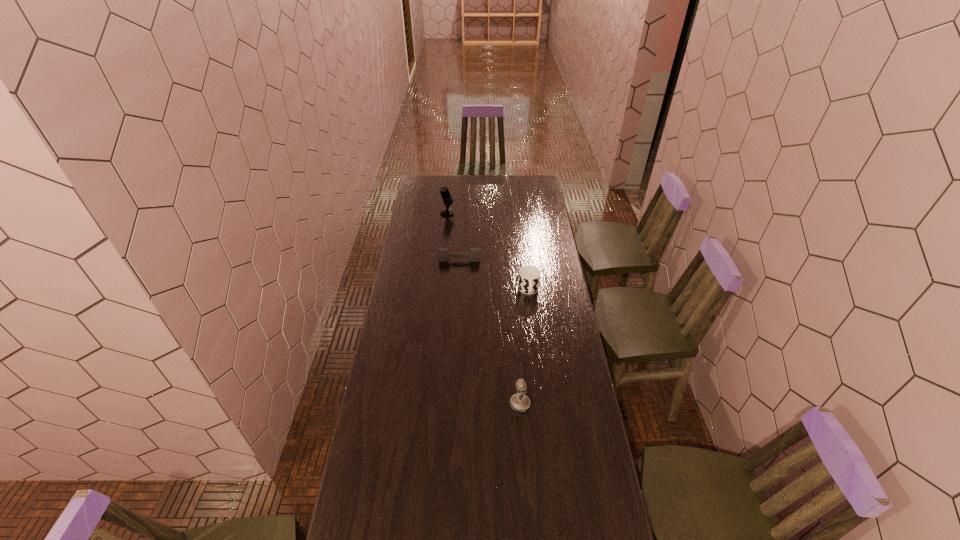
Image resolution: width=960 pixels, height=540 pixels. Identify the location of vacant space located 0.140m on the front-facing side of the shorter microphone. [x=473, y=404].

Locate an element on the screen. This screenshot has width=960, height=540. free space located 0.070m on the front-facing side of the shorter microphone is located at coordinates (492, 404).

The width and height of the screenshot is (960, 540). Find the location of `blank space located on the side of the second nearest object with the handle`. blank space located on the side of the second nearest object with the handle is located at coordinates (538, 368).

Find the location of a particular element. The width and height of the screenshot is (960, 540). vacant space located on the right of the second farthest object is located at coordinates (542, 260).

Find the location of a particular element. object that is at the right edge is located at coordinates (529, 276).

The height and width of the screenshot is (540, 960). I want to click on vacant space at the far edge of the desktop, so click(452, 179).

I want to click on free spot at the left edge of the desktop, so click(403, 267).

Identify the location of free space at the right edge. The height and width of the screenshot is (540, 960). [540, 311].

Locate an element on the screen. free region at the far left corner is located at coordinates (420, 183).

You are a GUI agent. You are given a task and a screenshot of the screen. Output one action in this format:
    pyautogui.click(x=<x>, y=<y>)
    Task: Click on the free space at the far right corner
    The height and width of the screenshot is (540, 960).
    Given the screenshot: What is the action you would take?
    pyautogui.click(x=538, y=182)